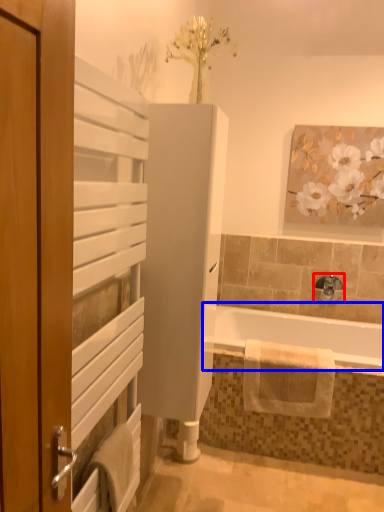
Question: Which of the following is the closest to the observer, tap (highlighted by a red box) or bathtub (highlighted by a blue box)?

Choices:
 (A) tap
 (B) bathtub

Answer: (B)